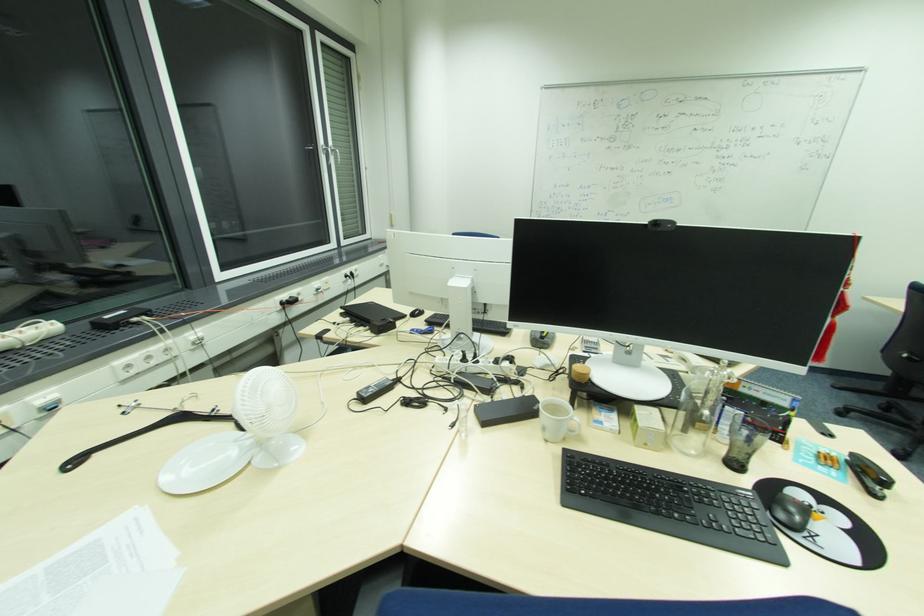
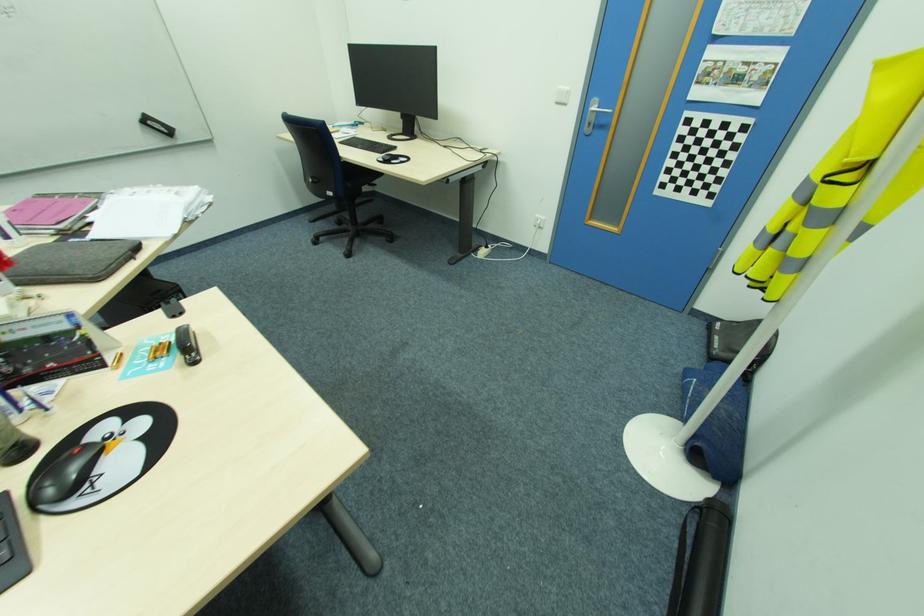
The images are taken continuously from a first-person perspective. In which direction is your viewpoint rotating?

The camera's rotation is toward right-down.